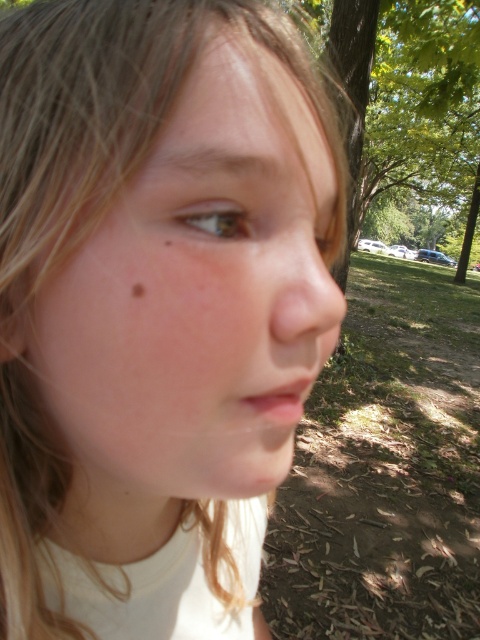
Question: In this image, where is smooth skin face at center located relative to brown matte freckle at lower left?

Choices:
 (A) left
 (B) right

Answer: (B)

Question: Which point appears farthest from the camera in this image?

Choices:
 (A) (133, 292)
 (B) (307, 196)

Answer: (B)

Question: Which point is farther to the camera?

Choices:
 (A) brown matte freckle at lower left
 (B) smooth skin face at center

Answer: (A)

Question: Is smooth skin face at center wider than brown matte freckle at lower left?

Choices:
 (A) yes
 (B) no

Answer: (A)

Question: Where is smooth skin face at center located in relation to brown matte freckle at lower left in the image?

Choices:
 (A) above
 (B) below

Answer: (B)